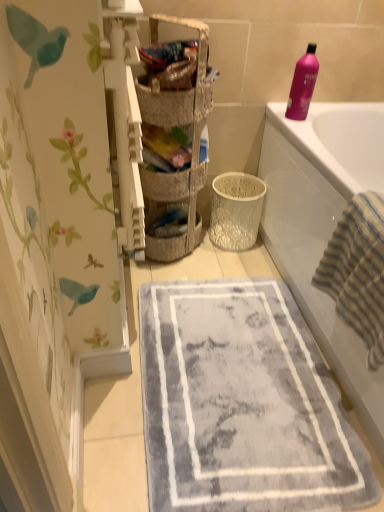
You are a GUI agent. You are given a task and a screenshot of the screen. Output one action in this format:
    pyautogui.click(x=<x>, y=<y>)
    Task: Click on the free location to the right of woven basket at center
    Image resolution: width=384 pixels, height=512 pixels.
    Given the screenshot: What is the action you would take?
    pyautogui.click(x=231, y=261)